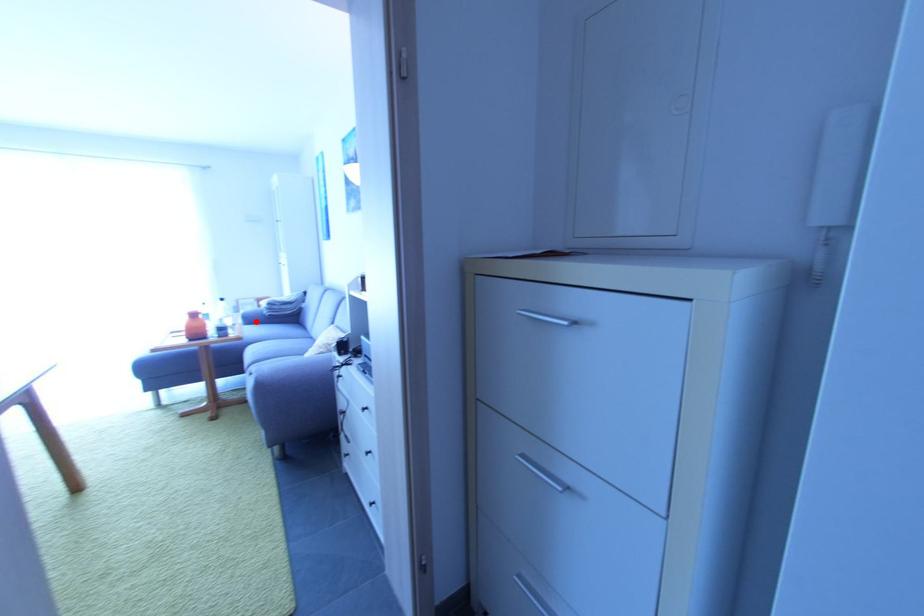
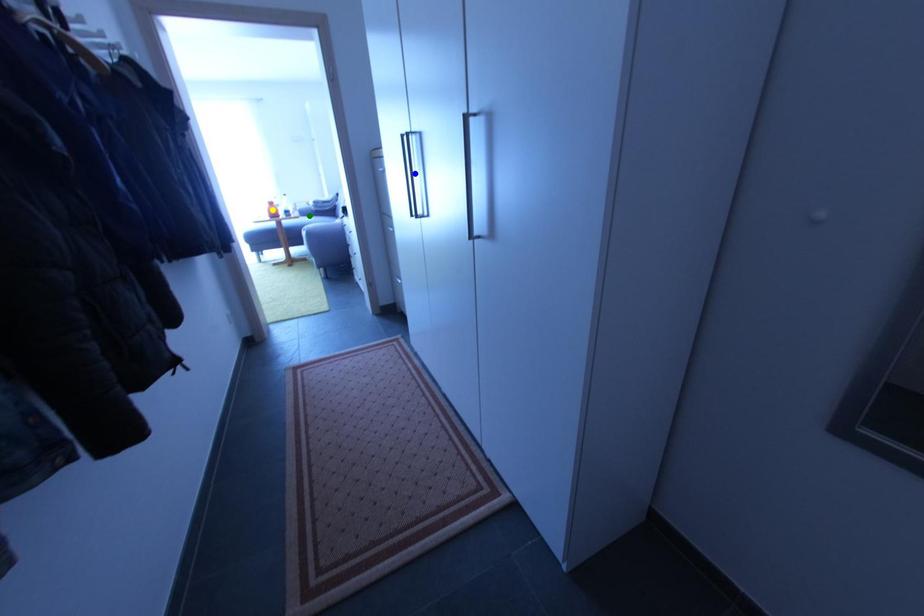
Question: I am providing you with two images of the same scene from different viewpoints. A red point is marked on the first image. You are given multiple points on the second image. Which mark in image 2 goes with the point in image 1?

Choices:
 (A) green point
 (B) yellow point
 (C) blue point

Answer: (A)